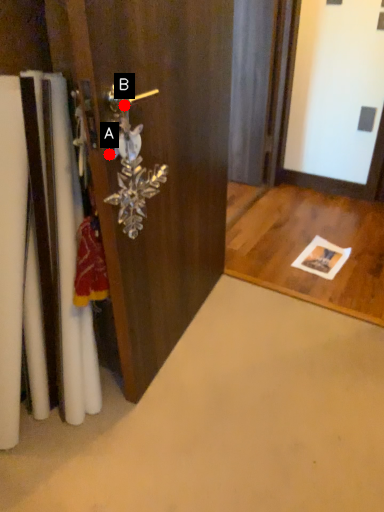
Question: Two points are circled on the image, labeled by A and B beside each circle. Which point is closer to the camera taking this photo?

Choices:
 (A) A is closer
 (B) B is closer

Answer: (B)